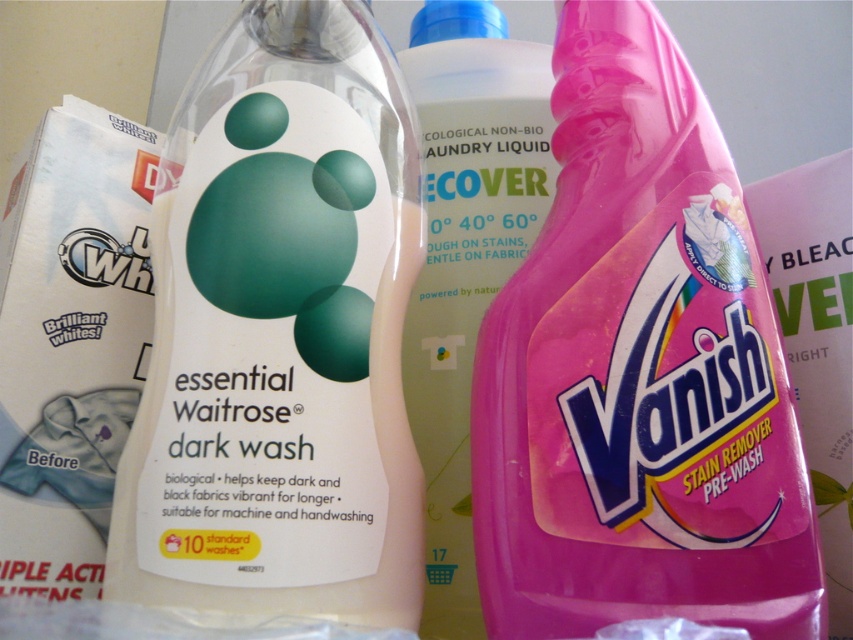
Question: Estimate the real-world distances between objects in this image. Which object is farther from the white matte bottle at center?

Choices:
 (A) translucent plastic bottle at center
 (B) pink plastic vanish stain remover at right

Answer: (B)

Question: Which object is farther from the camera taking this photo?

Choices:
 (A) pink plastic vanish stain remover at right
 (B) translucent plastic bottle at center

Answer: (B)

Question: Observing the image, what is the correct spatial positioning of white matte bottle at center in reference to translucent plastic bottle at center?

Choices:
 (A) left
 (B) right

Answer: (A)

Question: Does pink plastic vanish stain remover at right have a larger size compared to translucent plastic bottle at center?

Choices:
 (A) yes
 (B) no

Answer: (B)

Question: Where is pink plastic vanish stain remover at right located in relation to translucent plastic bottle at center in the image?

Choices:
 (A) below
 (B) above

Answer: (A)

Question: Among these objects, which one is farthest from the camera?

Choices:
 (A) pink plastic vanish stain remover at right
 (B) translucent plastic bottle at center

Answer: (B)